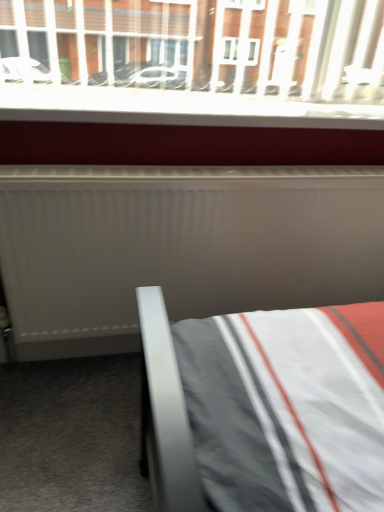
This screenshot has width=384, height=512. I want to click on free space above white plastic window sill at upper center (from a real-world perspective), so click(185, 99).